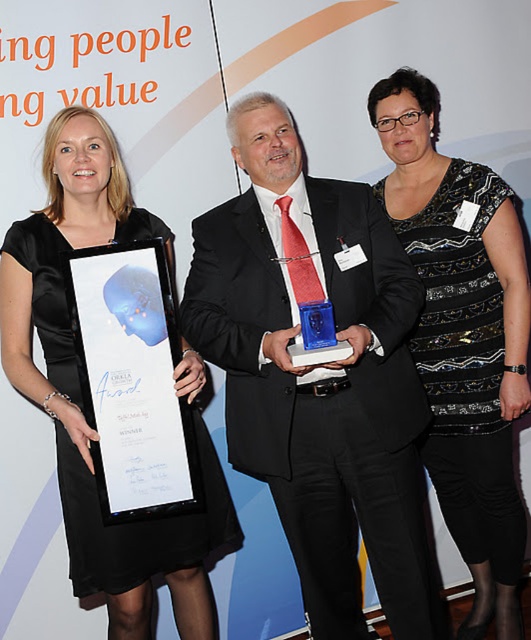
Consider the image. You are a photographer at the event and need to capture a photo of both the black sequined dress at center and the satin black dress at left. Based on their positions, which dress is positioned higher in the frame?

The black sequined dress at center is positioned higher in the frame than the satin black dress at left.